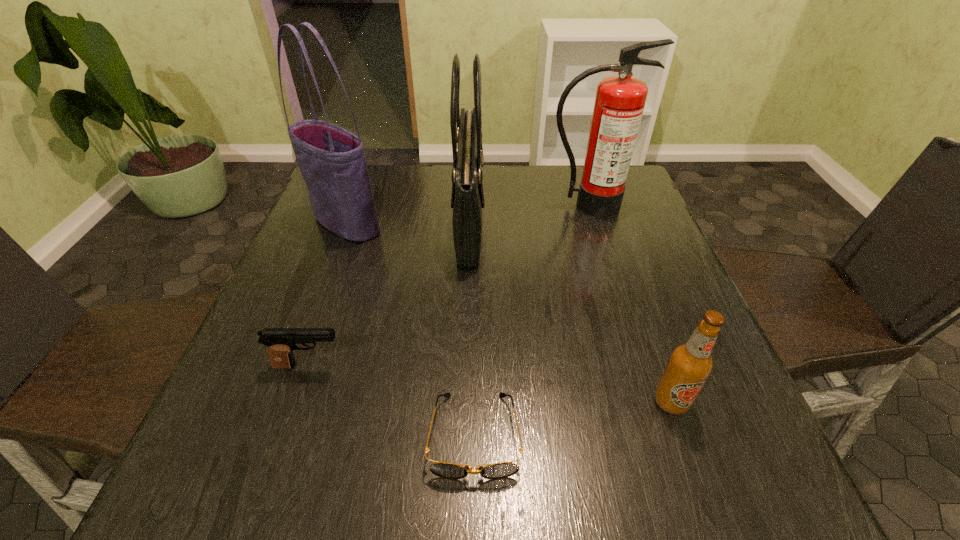
Identify the location of object positioned at the far left corner. (332, 161).

You are a GUI agent. You are given a task and a screenshot of the screen. Output one action in this format:
    pyautogui.click(x=<x>, y=<y>)
    Task: Click on the object present at the far right corner
    The height and width of the screenshot is (540, 960).
    Given the screenshot: What is the action you would take?
    pyautogui.click(x=620, y=100)

This screenshot has height=540, width=960. In the image, there is a desktop. What are the coordinates of `vacant space at the far edge` in the screenshot? It's located at (x=569, y=166).

This screenshot has height=540, width=960. Identify the location of vacant space at the near edge of the desktop. (538, 496).

Where is `free space at the left edge of the desktop`? The width and height of the screenshot is (960, 540). free space at the left edge of the desktop is located at coordinates (292, 284).

The width and height of the screenshot is (960, 540). In the image, there is a desktop. Identify the location of vacant space at the right edge. click(639, 336).

Find the location of `free space at the far left corner of the desktop`. free space at the far left corner of the desktop is located at coordinates (372, 174).

This screenshot has height=540, width=960. What are the coordinates of `vacant position at the near left corner of the desktop` in the screenshot? It's located at pos(254,483).

Identify the location of free space at the far right corner of the desktop. This screenshot has width=960, height=540. (583, 173).

What are the coordinates of `blank area at the near right corner` in the screenshot? It's located at (704, 507).